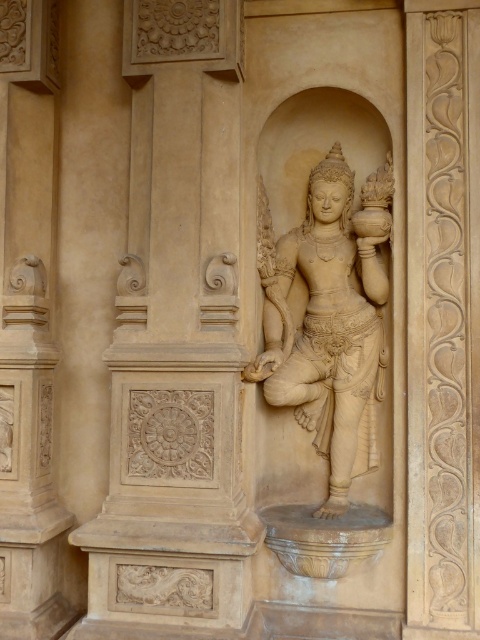
This screenshot has width=480, height=640. What are the coordinates of `beige stone column at center` in the screenshot? It's located at (176, 340).

Image resolution: width=480 pixels, height=640 pixels. Describe the element at coordinates (176, 340) in the screenshot. I see `beige stone column at center` at that location.

Image resolution: width=480 pixels, height=640 pixels. What are the coordinates of `beige stone column at center` in the screenshot? It's located at tap(176, 340).